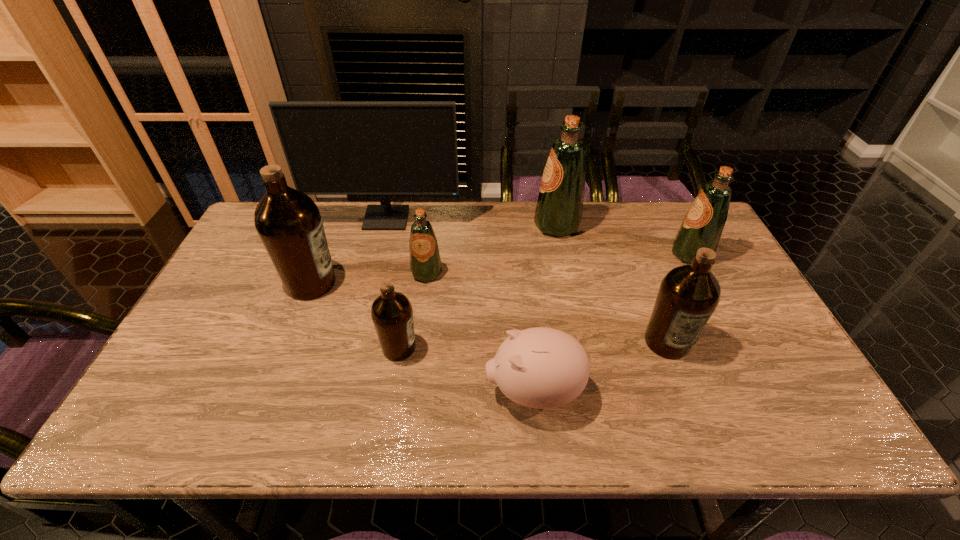
Locate an element on the screen. This screenshot has height=540, width=960. free spot at the far edge of the desktop is located at coordinates (497, 241).

Image resolution: width=960 pixels, height=540 pixels. In order to click on vacant space at the left edge in this screenshot , I will do coord(204,325).

In the image, there is a desktop. Where is `vacant space at the far right corner`? The image size is (960, 540). vacant space at the far right corner is located at coordinates (675, 227).

This screenshot has height=540, width=960. I want to click on free space between the leftmost green olive oil and the leftmost olive oil, so click(x=369, y=278).

Locate an element on the screen. The width and height of the screenshot is (960, 540). free spot between the shortest object and the biggest green olive oil is located at coordinates (545, 308).

Where is `free space between the biggest green olive oil and the smallest green olive oil`? The height and width of the screenshot is (540, 960). free space between the biggest green olive oil and the smallest green olive oil is located at coordinates (492, 249).

In order to click on vacant region between the computer monitor and the biggest green olive oil in this screenshot , I will do `click(471, 222)`.

At what (x,y) coordinates should I click in order to perform the action: click on free space between the computer monitor and the smallest green olive oil. Please return your answer as a coordinate pair (x, y). Image resolution: width=960 pixels, height=540 pixels. Looking at the image, I should click on [x=406, y=246].

This screenshot has width=960, height=540. I want to click on empty location between the piggy bank and the farthest green olive oil, so click(x=545, y=308).

Locate an element on the screen. The height and width of the screenshot is (540, 960). free space between the shortest object and the second object from right to left is located at coordinates (600, 367).